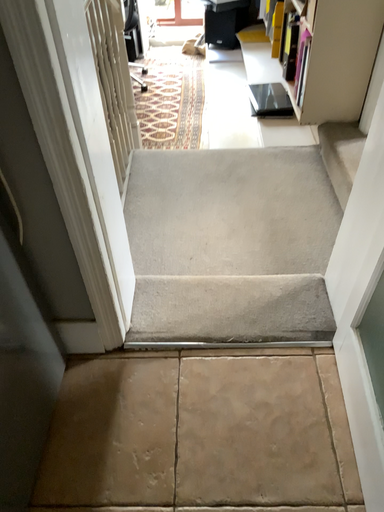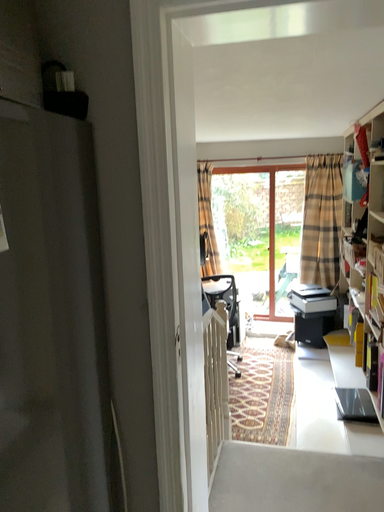
Question: How did the camera likely rotate when shooting the video?

Choices:
 (A) rotated upward
 (B) rotated downward

Answer: (A)